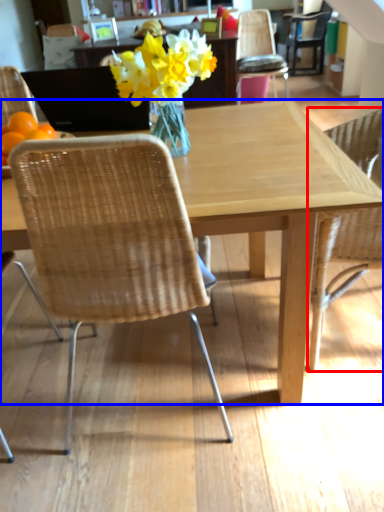
Question: Which object is closer to the camera taking this photo, chair (highlighted by a red box) or kitchen & dining room table (highlighted by a blue box)?

Choices:
 (A) chair
 (B) kitchen & dining room table

Answer: (B)